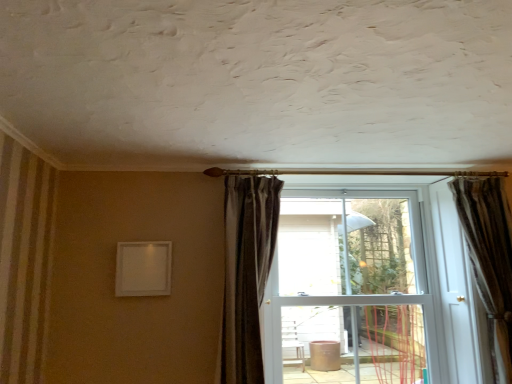
Question: From the image's perspective, is white glossy door at center positioned above or below brown textured curtain at right, the 1th curtain viewed from the right?

Choices:
 (A) below
 (B) above

Answer: (A)

Question: From their relative heights in the image, would you say white glossy door at center is taller or shorter than brown textured curtain at right, the 1th curtain viewed from the right?

Choices:
 (A) short
 (B) tall

Answer: (B)

Question: Which object is the farthest from the dark brown velvet curtain at center, arranged as the first curtain when viewed from the left?

Choices:
 (A) white glossy door at center
 (B) brown textured curtain at right, the 1th curtain viewed from the right

Answer: (B)

Question: Which is nearer to the dark brown velvet curtain at center, arranged as the first curtain when viewed from the left?

Choices:
 (A) brown textured curtain at right, positioned as the 2th curtain in left-to-right order
 (B) white glossy door at center

Answer: (B)